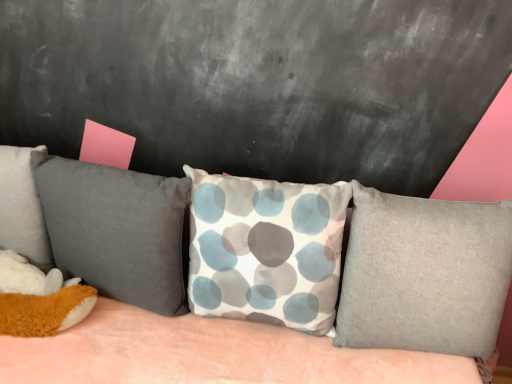
What do you see at coordinates (266, 250) in the screenshot?
I see `white fabric pillow with blue and gray circles at center, which appears as the 2th pillow when viewed from the right` at bounding box center [266, 250].

What is the approximate width of textured fabric couch at center?

The width of textured fabric couch at center is 1.09 meters.

Find the location of a particular element. The height and width of the screenshot is (384, 512). white fabric pillow with blue and gray circles at center, which appears as the 2th pillow when viewed from the right is located at coordinates pos(266,250).

Are soft gray pillow at left, the first pillow in the left-to-right sequence, and gray fabric pillow at center, which is counted as the first pillow, starting from the right, located far from each other?

Indeed, soft gray pillow at left, the first pillow in the left-to-right sequence, is not near gray fabric pillow at center, which is counted as the first pillow, starting from the right.

From a real-world perspective, does soft gray pillow at left, the first pillow in the left-to-right sequence, sit lower than gray fabric pillow at center, the 4th pillow when ordered from left to right?

No, from a real-world perspective, soft gray pillow at left, the first pillow in the left-to-right sequence, is not beneath gray fabric pillow at center, the 4th pillow when ordered from left to right.

Which object is closer to the camera taking this photo, soft gray pillow at left, the first pillow in the left-to-right sequence, or gray fabric pillow at center, the 4th pillow when ordered from left to right?

gray fabric pillow at center, the 4th pillow when ordered from left to right.

Looking at this image, is soft gray pillow at left, which is counted as the fourth pillow, starting from the right, oriented away from gray fabric pillow at center, which is counted as the first pillow, starting from the right?

That's not correct — soft gray pillow at left, which is counted as the fourth pillow, starting from the right, is not looking away from gray fabric pillow at center, which is counted as the first pillow, starting from the right.

From a real-world perspective, does textured fabric couch at center stand above white fabric pillow with blue and gray circles at center, which appears as the 2th pillow when viewed from the right?

No, from a real-world perspective, textured fabric couch at center is not over white fabric pillow with blue and gray circles at center, which appears as the 2th pillow when viewed from the right

The image size is (512, 384). Identify the location of the 1st pillow to the right when counting from the textured fabric couch at center. (266, 250).

From the image's perspective, relative to white fabric pillow with blue and gray circles at center, which appears as the 2th pillow when viewed from the right, is textured fabric couch at center above or below?

Clearly, from the image's perspective, textured fabric couch at center is below white fabric pillow with blue and gray circles at center, which appears as the 2th pillow when viewed from the right.

Considering the relative positions of white fabric pillow with blue and gray circles at center, which appears as the 2th pillow when viewed from the right, and velvety gray pillow at left, which appears as the third pillow when viewed from the right, in the image provided, is white fabric pillow with blue and gray circles at center, which appears as the 2th pillow when viewed from the right, in front of velvety gray pillow at left, which appears as the third pillow when viewed from the right,?

Yes, it is in front of velvety gray pillow at left, which appears as the third pillow when viewed from the right.

Is point (262, 202) positioned in front of point (161, 193)?

That is False.

Is white fabric pillow with blue and gray circles at center, which appears as the 2th pillow when viewed from the right, in contact with velvety gray pillow at left, positioned as the second pillow in left-to-right order?

They are not placed beside each other.

Which is farther, (4,168) or (16,348)?

Point (4,168)

From their relative heights in the image, would you say soft gray pillow at left, which is counted as the fourth pillow, starting from the right, is taller or shorter than textured fabric couch at center?

Considering their sizes, soft gray pillow at left, which is counted as the fourth pillow, starting from the right, has less height than textured fabric couch at center.

At what (x,y) coordinates should I click in order to perform the action: click on the 4th pillow above when counting from the textured fabric couch at center (from the image's perspective). Please return your answer as a coordinate pair (x, y). The height and width of the screenshot is (384, 512). Looking at the image, I should click on (23, 206).

How many degrees apart are the facing directions of velvety gray pillow at left, positioned as the second pillow in left-to-right order, and soft gray pillow at left, the first pillow in the left-to-right sequence?

The angle between the facing direction of velvety gray pillow at left, positioned as the second pillow in left-to-right order, and the facing direction of soft gray pillow at left, the first pillow in the left-to-right sequence, is 4.27 degrees.

Can we say velvety gray pillow at left, which appears as the third pillow when viewed from the right, lies outside soft gray pillow at left, which is counted as the fourth pillow, starting from the right?

Yes, velvety gray pillow at left, which appears as the third pillow when viewed from the right, is outside of soft gray pillow at left, which is counted as the fourth pillow, starting from the right.

Where is `the 2nd pillow directly above the velvety gray pillow at left, positioned as the second pillow in left-to-right order (from a real-world perspective)`? the 2nd pillow directly above the velvety gray pillow at left, positioned as the second pillow in left-to-right order (from a real-world perspective) is located at coordinates click(23, 206).

Considering the sizes of objects velvety gray pillow at left, which appears as the third pillow when viewed from the right, and soft gray pillow at left, the first pillow in the left-to-right sequence, in the image provided, who is smaller, velvety gray pillow at left, which appears as the third pillow when viewed from the right, or soft gray pillow at left, the first pillow in the left-to-right sequence,?

With smaller size is soft gray pillow at left, the first pillow in the left-to-right sequence.

Is velvety gray pillow at left, which appears as the third pillow when viewed from the right, oriented away from gray fabric pillow at center, which is counted as the first pillow, starting from the right?

No.

From the image's perspective, is velvety gray pillow at left, which appears as the third pillow when viewed from the right, positioned above or below gray fabric pillow at center, the 4th pillow when ordered from left to right?

velvety gray pillow at left, which appears as the third pillow when viewed from the right, is situated higher than gray fabric pillow at center, the 4th pillow when ordered from left to right, in the image.

Considering the positions of objects velvety gray pillow at left, positioned as the second pillow in left-to-right order, and gray fabric pillow at center, the 4th pillow when ordered from left to right, in the image provided, who is more to the left, velvety gray pillow at left, positioned as the second pillow in left-to-right order, or gray fabric pillow at center, the 4th pillow when ordered from left to right,?

velvety gray pillow at left, positioned as the second pillow in left-to-right order.

Is the position of textured fabric couch at center more distant than that of soft gray pillow at left, the first pillow in the left-to-right sequence?

No, textured fabric couch at center is closer to the viewer.

Is textured fabric couch at center to the right of soft gray pillow at left, the first pillow in the left-to-right sequence, from the viewer's perspective?

Yes, textured fabric couch at center is to the right of soft gray pillow at left, the first pillow in the left-to-right sequence.

How much distance is there between textured fabric couch at center and soft gray pillow at left, which is counted as the fourth pillow, starting from the right?

textured fabric couch at center and soft gray pillow at left, which is counted as the fourth pillow, starting from the right, are 14.46 inches apart from each other.

From the image's perspective, is textured fabric couch at center located above or below soft gray pillow at left, the first pillow in the left-to-right sequence?

Clearly, from the image's perspective, textured fabric couch at center is below soft gray pillow at left, the first pillow in the left-to-right sequence.

From a real-world perspective, which pillow is the 1st one underneath the soft gray pillow at left, the first pillow in the left-to-right sequence? Please provide its 2D coordinates.

[(424, 274)]

I want to click on the 1st pillow behind the textured fabric couch at center, starting your count from the anchor, so click(x=266, y=250).

Consider the image. Estimate the real-world distances between objects in this image. Which object is further from gray fabric pillow at center, the 4th pillow when ordered from left to right, textured fabric couch at center or soft gray pillow at left, which is counted as the fourth pillow, starting from the right?

soft gray pillow at left, which is counted as the fourth pillow, starting from the right, is further to gray fabric pillow at center, the 4th pillow when ordered from left to right.

From the image, which object appears to be farther from gray fabric pillow at center, the 4th pillow when ordered from left to right, soft gray pillow at left, the first pillow in the left-to-right sequence, or textured fabric couch at center?

Based on the image, soft gray pillow at left, the first pillow in the left-to-right sequence, appears to be further to gray fabric pillow at center, the 4th pillow when ordered from left to right.

From the image, which object appears to be nearer to white fabric pillow with blue and gray circles at center, the 3th pillow when ordered from left to right, gray fabric pillow at center, which is counted as the first pillow, starting from the right, or soft gray pillow at left, which is counted as the fourth pillow, starting from the right?

The object closer to white fabric pillow with blue and gray circles at center, the 3th pillow when ordered from left to right, is gray fabric pillow at center, which is counted as the first pillow, starting from the right.

When comparing their distances from gray fabric pillow at center, the 4th pillow when ordered from left to right, does soft gray pillow at left, the first pillow in the left-to-right sequence, or white fabric pillow with blue and gray circles at center, which appears as the 2th pillow when viewed from the right, seem further?

soft gray pillow at left, the first pillow in the left-to-right sequence, is further to gray fabric pillow at center, the 4th pillow when ordered from left to right.

Based on their spatial positions, is soft gray pillow at left, the first pillow in the left-to-right sequence, or gray fabric pillow at center, which is counted as the first pillow, starting from the right, closer to white fabric pillow with blue and gray circles at center, which appears as the 2th pillow when viewed from the right?

→ Based on the image, gray fabric pillow at center, which is counted as the first pillow, starting from the right, appears to be nearer to white fabric pillow with blue and gray circles at center, which appears as the 2th pillow when viewed from the right.

Estimate the real-world distances between objects in this image. Which object is further from white fabric pillow with blue and gray circles at center, which appears as the 2th pillow when viewed from the right, textured fabric couch at center or gray fabric pillow at center, which is counted as the first pillow, starting from the right?

gray fabric pillow at center, which is counted as the first pillow, starting from the right, is positioned further to the anchor white fabric pillow with blue and gray circles at center, which appears as the 2th pillow when viewed from the right.

When comparing their distances from textured fabric couch at center, does gray fabric pillow at center, the 4th pillow when ordered from left to right, or velvety gray pillow at left, positioned as the second pillow in left-to-right order, seem closer?

velvety gray pillow at left, positioned as the second pillow in left-to-right order, is closer to textured fabric couch at center.

Considering their positions, is gray fabric pillow at center, the 4th pillow when ordered from left to right, positioned further to soft gray pillow at left, which is counted as the fourth pillow, starting from the right, than textured fabric couch at center?

gray fabric pillow at center, the 4th pillow when ordered from left to right, is further to soft gray pillow at left, which is counted as the fourth pillow, starting from the right.

This screenshot has height=384, width=512. I want to click on pillow between soft gray pillow at left, which is counted as the fourth pillow, starting from the right, and white fabric pillow with blue and gray circles at center, the 3th pillow when ordered from left to right, in the horizontal direction, so click(116, 230).

The height and width of the screenshot is (384, 512). What are the coordinates of `studio couch between velvety gray pillow at left, which appears as the third pillow when viewed from the right, and gray fabric pillow at center, which is counted as the first pillow, starting from the right` in the screenshot? It's located at (205, 353).

The image size is (512, 384). What are the coordinates of `pillow between velvety gray pillow at left, which appears as the third pillow when viewed from the right, and gray fabric pillow at center, which is counted as the first pillow, starting from the right, in the horizontal direction` in the screenshot? It's located at (266, 250).

You are a GUI agent. You are given a task and a screenshot of the screen. Output one action in this format:
    pyautogui.click(x=<x>, y=<y>)
    Task: Click on the studio couch between soft gray pillow at left, which is counted as the fourth pillow, starting from the right, and white fabric pillow with blue and gray circles at center, the 3th pillow when ordered from left to right, from left to right
    The image size is (512, 384).
    Given the screenshot: What is the action you would take?
    pyautogui.click(x=205, y=353)